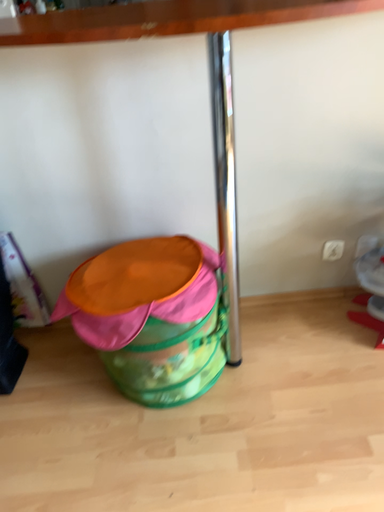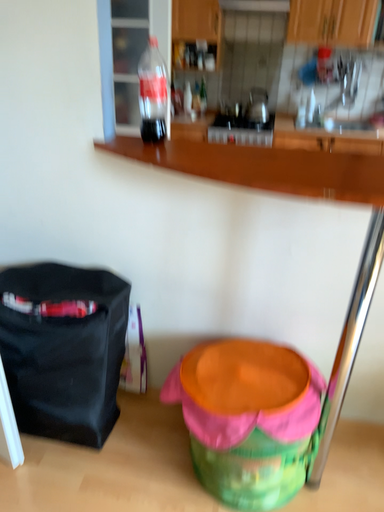
Question: Which way did the camera rotate in the video?

Choices:
 (A) rotated upward
 (B) rotated downward

Answer: (A)